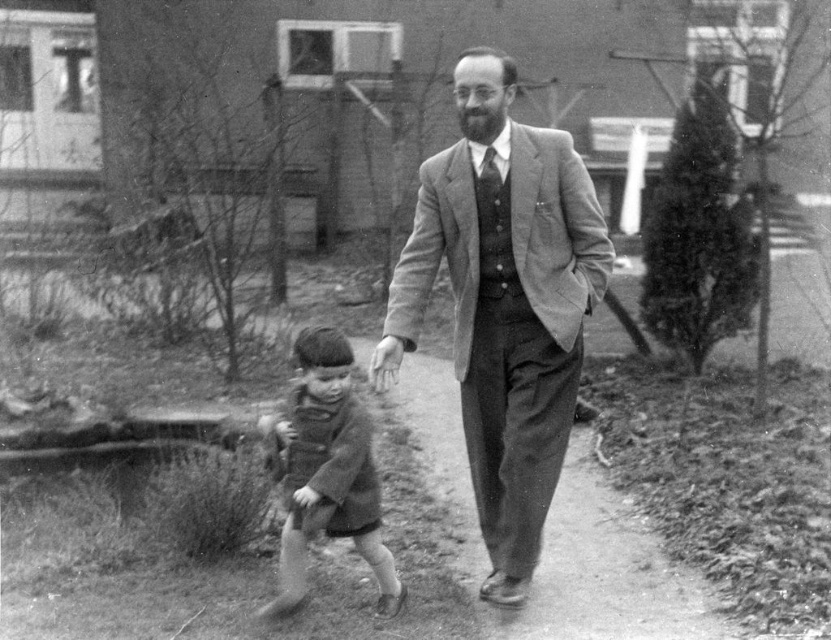
Question: Is smooth woolen suit at center to the right of dull gray concrete at center from the viewer's perspective?

Choices:
 (A) yes
 (B) no

Answer: (B)

Question: Which point is farther to the camera?

Choices:
 (A) smooth woolen suit at center
 (B) dull gray concrete at center

Answer: (B)

Question: Can you confirm if smooth woolen suit at center is positioned below dull gray concrete at center?

Choices:
 (A) no
 (B) yes

Answer: (A)

Question: Estimate the real-world distances between objects in this image. Which object is farther from the dull gray concrete at center?

Choices:
 (A) smooth woolen suit at center
 (B) coarse wool sweater at center

Answer: (B)

Question: Which point appears closest to the camera in this image?

Choices:
 (A) click(x=542, y=628)
 (B) click(x=475, y=128)

Answer: (B)

Question: Is dull gray concrete at center thinner than coarse wool sweater at center?

Choices:
 (A) yes
 (B) no

Answer: (B)